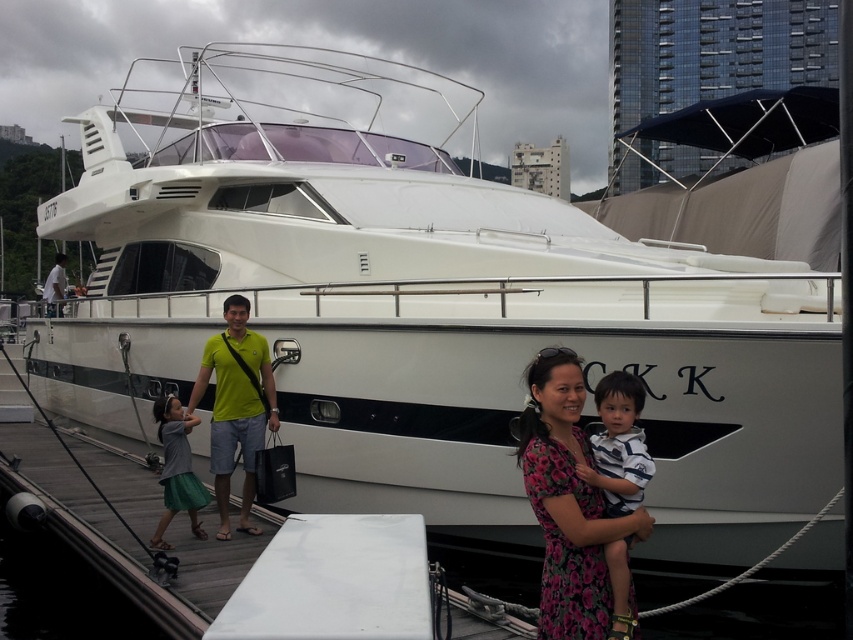
Who is lower down, yellow fabric shirt at center or striped cotton shirt at center?

Positioned lower is yellow fabric shirt at center.

Is point (225, 412) behind point (621, 477)?

That is True.

I want to click on yellow fabric shirt at center, so click(x=236, y=406).

This screenshot has width=853, height=640. Find the location of `yellow fabric shirt at center`. yellow fabric shirt at center is located at coordinates (236, 406).

Between matte gray dress at lower left and light green fabric shirt at center, which one appears on the left side from the viewer's perspective?

light green fabric shirt at center is more to the left.

Does matte gray dress at lower left have a greater height compared to light green fabric shirt at center?

No, matte gray dress at lower left is not taller than light green fabric shirt at center.

Who is more distant from viewer, (178, 438) or (57, 285)?

The point (57, 285) is more distant.

I want to click on matte gray dress at lower left, so click(177, 468).

Which is in front, point (238, 413) or point (178, 452)?

Positioned in front is point (178, 452).

Between yellow fabric shirt at center and matte gray dress at lower left, which one has more height?

Standing taller between the two is yellow fabric shirt at center.

The image size is (853, 640). Find the location of `yellow fabric shirt at center`. yellow fabric shirt at center is located at coordinates (236, 406).